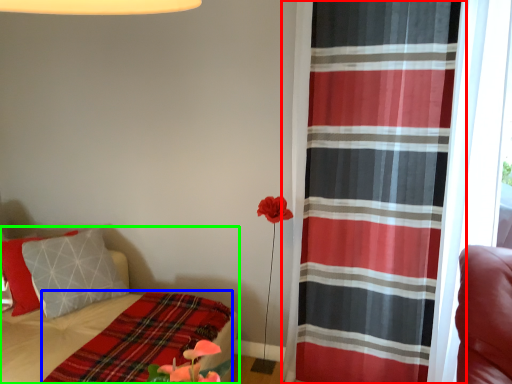
Question: Estimate the real-world distances between objects in this image. Which object is farther from curtain (highlighted by a red box), blanket (highlighted by a blue box) or bed (highlighted by a green box)?

Choices:
 (A) blanket
 (B) bed

Answer: (B)